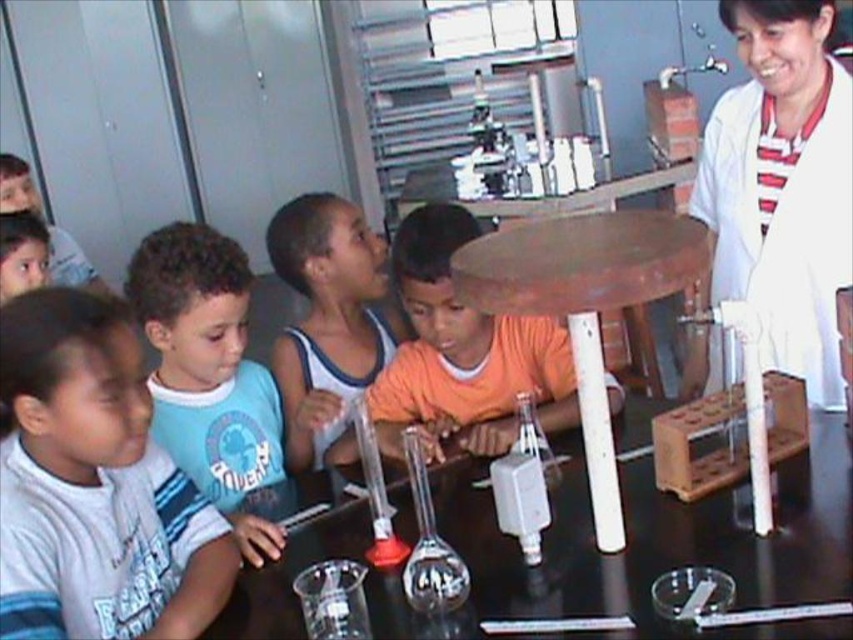
You are a student in the classroom and want to hand a note to the teacher wearing the white lab coat at upper right. Which direction should you move to reach the teacher from your current position near the white striped shirt at left?

Since the white striped shirt at left is below the white lab coat at upper right, you should move upward to reach the teacher wearing the white lab coat at upper right from your current position near the white striped shirt at left.